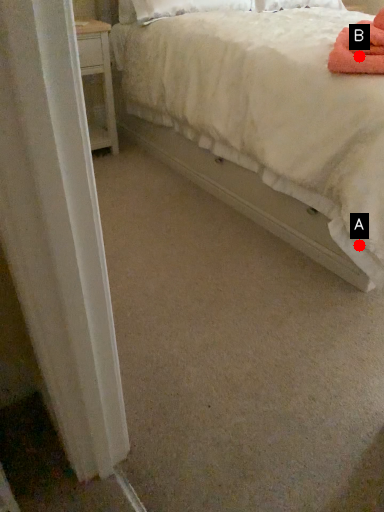
Question: Two points are circled on the image, labeled by A and B beside each circle. Which point appears closest to the camera in this image?

Choices:
 (A) A is closer
 (B) B is closer

Answer: (B)